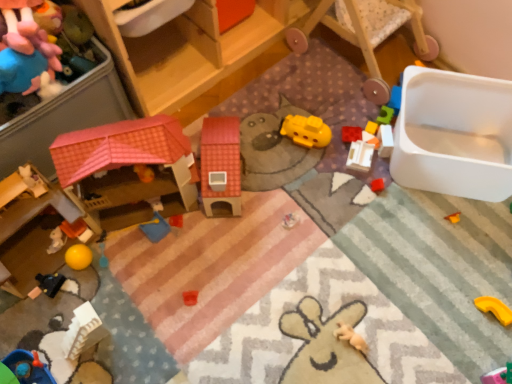
This screenshot has width=512, height=384. Identify the location of vacant region in front of light brown plush toy at lower right, which appears as the 6th toy when viewed from the left. (354, 369).